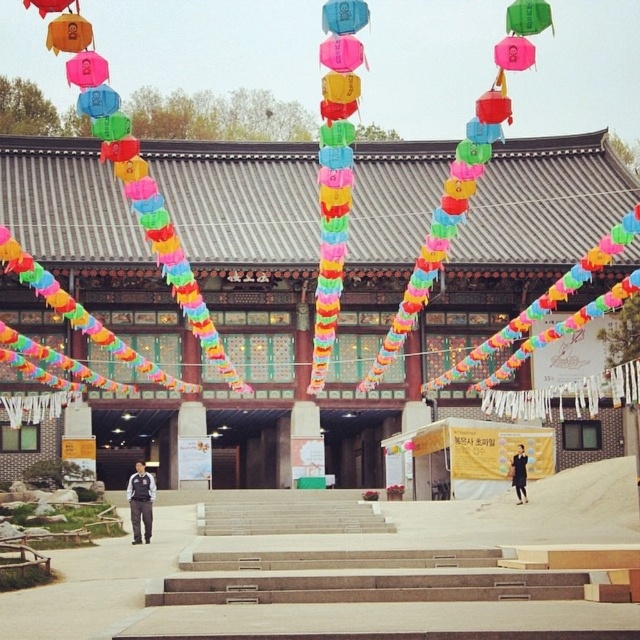
Question: Is pink paper lantern at upper center positioned before dark blue fabric coat at lower right?

Choices:
 (A) yes
 (B) no

Answer: (A)

Question: Which object is farther from the camera taking this photo?

Choices:
 (A) green matte lantern at upper center
 (B) dark blue fabric coat at lower right

Answer: (B)

Question: From the image, what is the correct spatial relationship of green matte lantern at upper center in relation to dark blue fabric coat at lower right?

Choices:
 (A) below
 (B) above

Answer: (B)

Question: Does green matte lantern at upper center have a lesser width compared to matte orange lantern at upper left?

Choices:
 (A) no
 (B) yes

Answer: (B)

Question: Which is nearer to the dark blue uniform at center?

Choices:
 (A) pink paper lantern at upper center
 (B) green matte lantern at upper center

Answer: (B)

Question: Among these points, which one is nearest to the camera?

Choices:
 (A) (515, 49)
 (B) (49, 8)

Answer: (B)